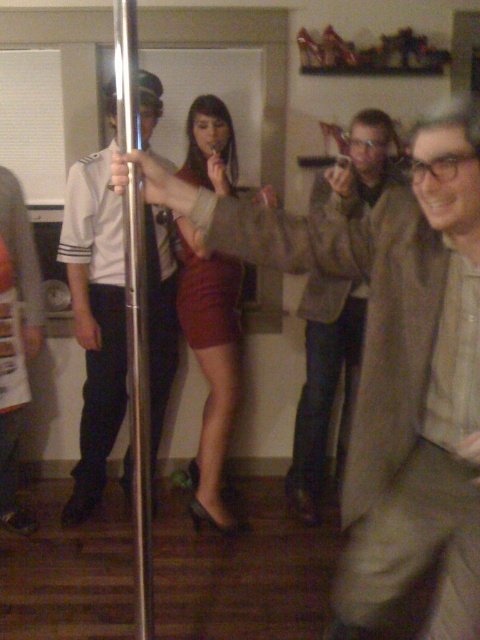
You are at a party and want to take a photo of the metallic pole at center and the burgundy satin skirt at center. Which object is closer to you?

The burgundy satin skirt at center is closer to you because the metallic pole at center is behind it.

You are at a party and want to take a photo of both the metallic pole at center and the khaki cotton shirt at center. Which object should you focus on first to ensure both are in the frame?

You should focus on the metallic pole at center first since it is in front of the khaki cotton shirt at center, ensuring both are visible in the frame.